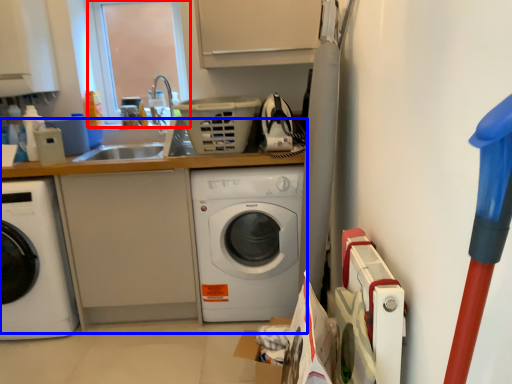
Question: Which point is closer to the camera, window screen (highlighted by a red box) or counter top (highlighted by a blue box)?

Choices:
 (A) window screen
 (B) counter top

Answer: (B)